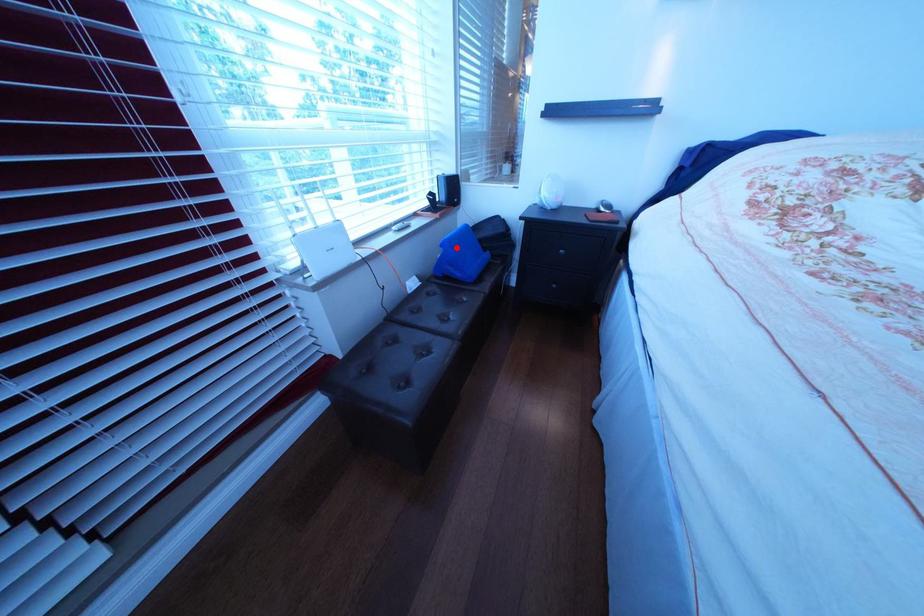
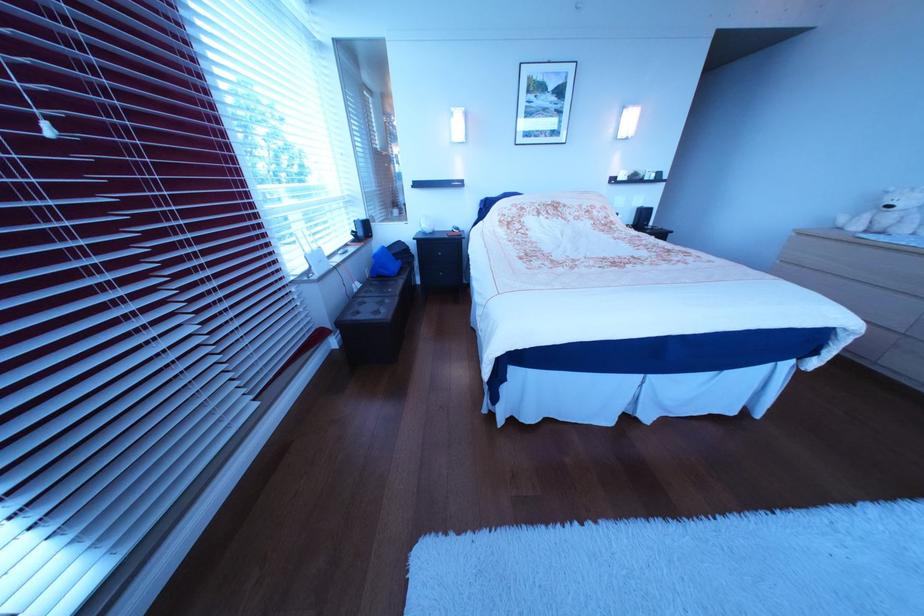
Question: A red point is marked in image1. In image2, is the corresponding 3D point closer to the camera or farther? Reply with the corresponding letter.

Choices:
 (A) The corresponding 3D point is closer.
 (B) The corresponding 3D point is farther.

Answer: (A)